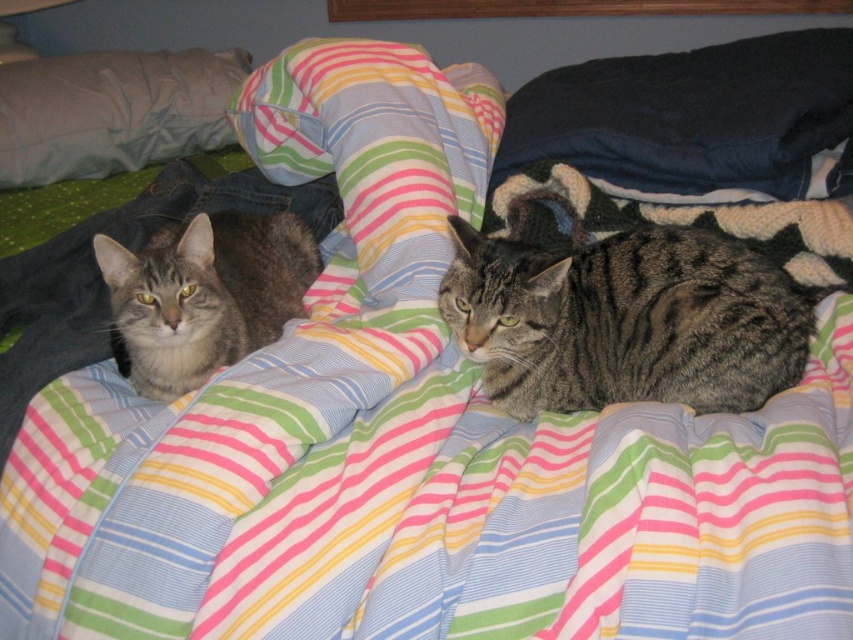
Question: Is gray tabby cat at center wider than gray tabby cat at left?

Choices:
 (A) no
 (B) yes

Answer: (B)

Question: Which point is farther to the camera?

Choices:
 (A) (279, 266)
 (B) (657, 369)
 (C) (194, 106)
 (D) (531, 128)

Answer: (C)

Question: Can you confirm if gray tabby cat at center is wider than dark blue fabric pillow at upper right?

Choices:
 (A) yes
 (B) no

Answer: (B)

Question: Is gray tabby cat at center positioned at the back of pillow at upper left?

Choices:
 (A) yes
 (B) no

Answer: (B)

Question: Which object is farther from the camera taking this photo?

Choices:
 (A) gray tabby cat at center
 (B) gray tabby cat at left
 (C) dark blue fabric pillow at upper right

Answer: (C)

Question: Which point appears closest to the camera in this image?

Choices:
 (A) (521, 384)
 (B) (120, 161)
 (C) (274, 291)

Answer: (A)